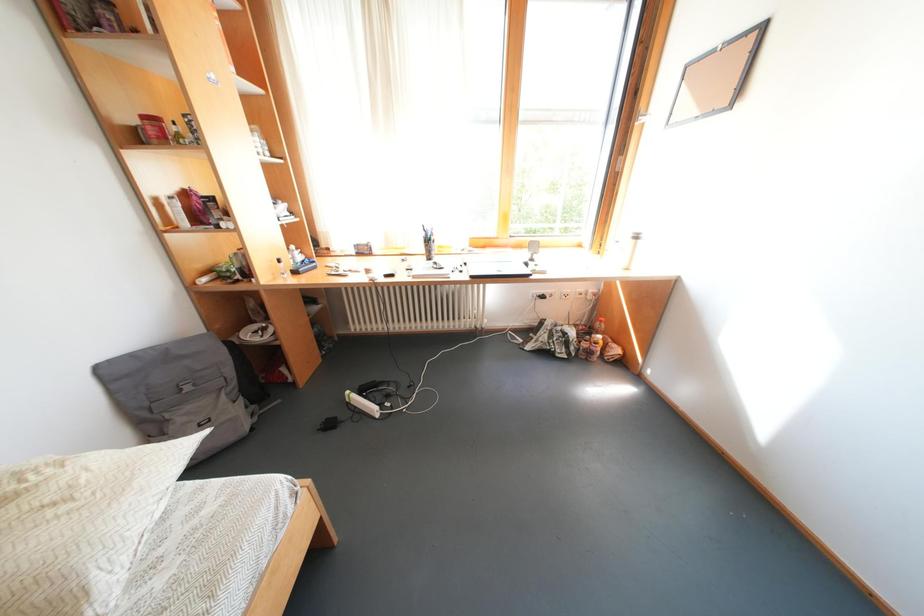
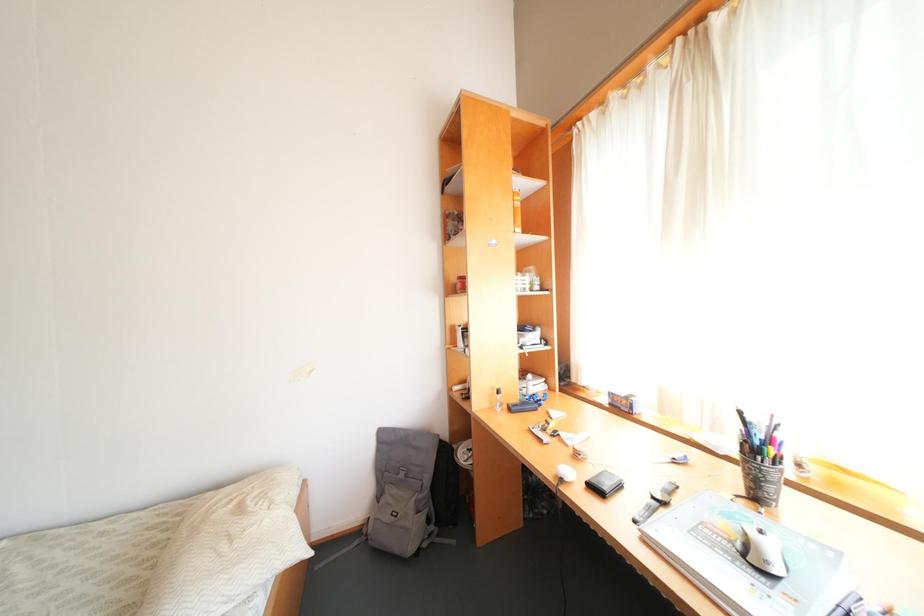
Question: How did the camera likely rotate?

Choices:
 (A) Left
 (B) Right
 (C) Up
 (D) Down

Answer: (A)